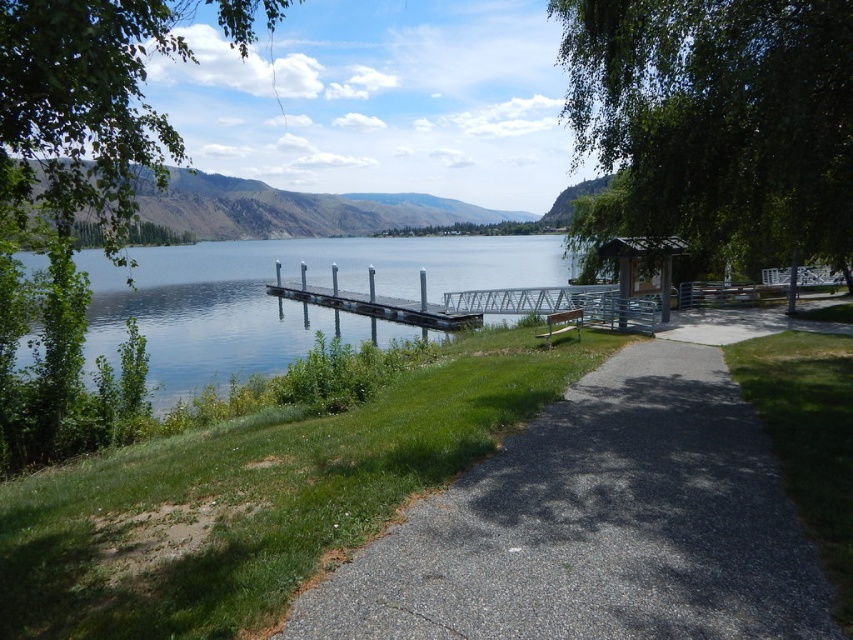
Is point (738, 51) positioned in front of point (402, 305)?

Yes.

Is green leafy tree at upper right closer to camera compared to metallic gray dock at center?

Yes.

Who is more distant from viewer, (634,13) or (399,314)?

The point (399,314) is behind.

Locate an element on the screen. green leafy tree at upper right is located at coordinates (718, 115).

Looking at this image, can you confirm if green leafy tree at left is smaller than metallic silver bench at lower center?

Incorrect, green leafy tree at left is not smaller in size than metallic silver bench at lower center.

Is green leafy tree at left to the right of metallic silver bench at lower center from the viewer's perspective?

In fact, green leafy tree at left is to the left of metallic silver bench at lower center.

Where is `green leafy tree at left`? The image size is (853, 640). green leafy tree at left is located at coordinates click(x=78, y=150).

Which is in front, point (360, 563) or point (44, 120)?

Point (360, 563) is more forward.

Is gray asphalt path at center to the left of green leafy tree at left from the viewer's perspective?

Incorrect, gray asphalt path at center is not on the left side of green leafy tree at left.

What do you see at coordinates (596, 525) in the screenshot? I see `gray asphalt path at center` at bounding box center [596, 525].

Identify the location of gray asphalt path at center. pos(596,525).